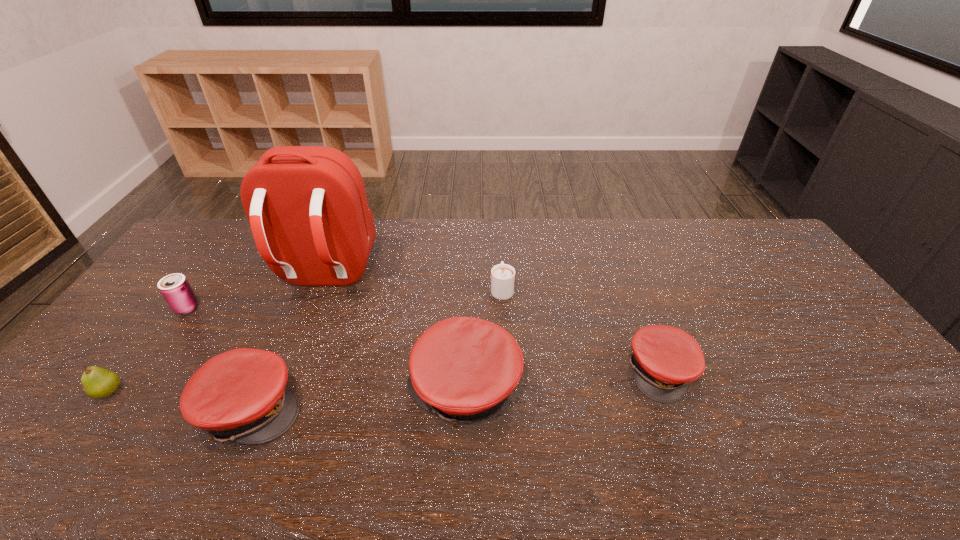
I want to click on vacant space located 0.130m on the front of the second cap from right to left with an emblem, so click(357, 389).

At what (x,y) coordinates should I click in order to perform the action: click on vacant space located 0.070m on the front of the second cap from right to left with an emblem. Please return your answer as a coordinate pair (x, y). Looking at the image, I should click on (380, 389).

What are the coordinates of `vacant area situated 0.300m on the front of the second cap from right to left with an emblem` in the screenshot? It's located at (292, 389).

Where is `vacant space located 0.070m on the front of the rightmost object with an emblem`? The image size is (960, 540). vacant space located 0.070m on the front of the rightmost object with an emblem is located at coordinates (683, 429).

Image resolution: width=960 pixels, height=540 pixels. Find the location of `free space located on the right of the can`. free space located on the right of the can is located at coordinates (x=266, y=307).

Image resolution: width=960 pixels, height=540 pixels. What are the coordinates of `free spot located 0.230m on the strap side of the tallest object` in the screenshot? It's located at (287, 368).

Locate an element on the screen. The width and height of the screenshot is (960, 540). free space located on the side with the handle of the cappuccino is located at coordinates (499, 239).

Find the location of a particular element. The image size is (960, 540). free space located 0.240m on the side with the handle of the cappuccino is located at coordinates (499, 236).

Identify the location of vacant space located on the side with the handle of the cappuccino. Image resolution: width=960 pixels, height=540 pixels. pos(499,242).

Where is `free location located on the back of the pear`? Image resolution: width=960 pixels, height=540 pixels. free location located on the back of the pear is located at coordinates (143, 346).